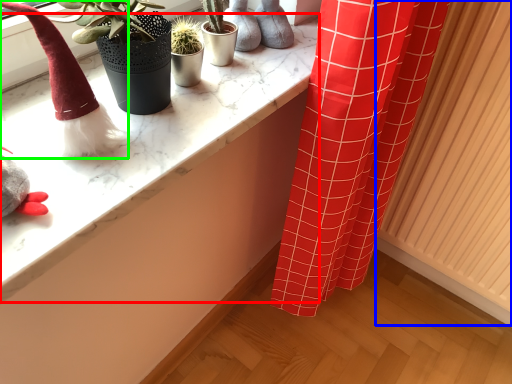
Question: Considering the real-world distances, which object is farthest from counter top (highlighted by a red box)? radiator (highlighted by a blue box) or toy (highlighted by a green box)?

Choices:
 (A) radiator
 (B) toy

Answer: (A)